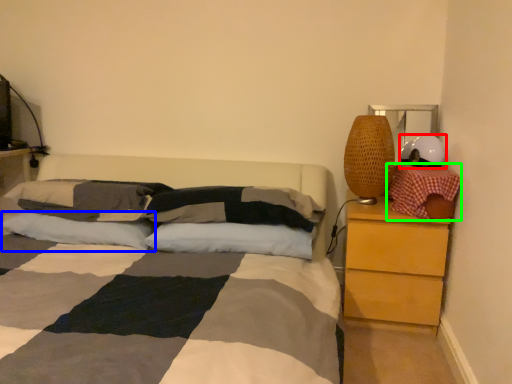
Question: Considering the real-world distances, which object is farthest from helmet (highlighted by a red box)? pillow (highlighted by a blue box) or pillow (highlighted by a green box)?

Choices:
 (A) pillow
 (B) pillow

Answer: (A)